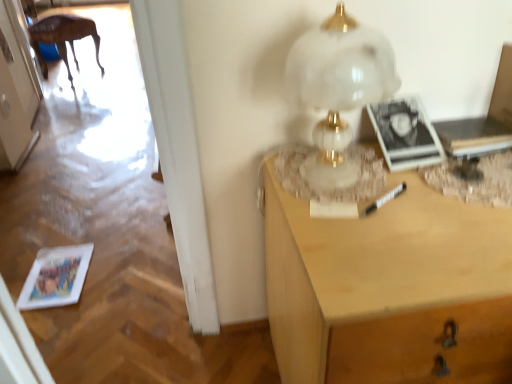
You are a GUI agent. You are given a task and a screenshot of the screen. Output one action in this format:
    pyautogui.click(x=<x>, y=<y>)
    Task: Click on the unoccupied region to the right of wooden table at left
    The image size is (512, 384).
    Given the screenshot: What is the action you would take?
    pyautogui.click(x=120, y=69)